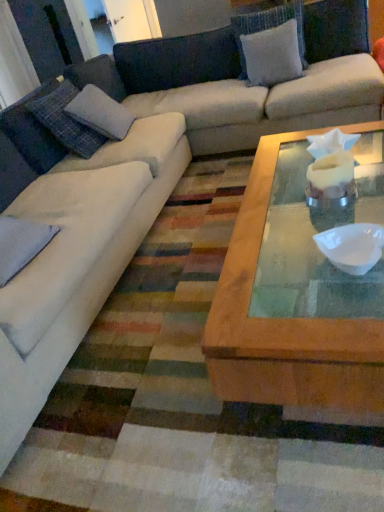
Where is `gray fabric pillow at left, acting as the 3th pillow starting from the back`? This screenshot has height=512, width=384. gray fabric pillow at left, acting as the 3th pillow starting from the back is located at coordinates (21, 244).

In order to face white fabric pillow at upper center, which ranks as the 1th pillow in back-to-front order, should I rotate leftwards or rightwards?

To face it directly, rotate right by 10.611 degrees.

What do you see at coordinates (352, 247) in the screenshot?
I see `white matte bowl at center` at bounding box center [352, 247].

Find the location of a particular element. This screenshot has width=384, height=512. gray fabric pillow at left, acting as the 3th pillow starting from the back is located at coordinates (21, 244).

How many degrees apart are the facing directions of white fabric pillow at upper center, which is counted as the third pillow, starting from the bottom, and gray fabric pillow at left, acting as the third pillow starting from the top?

white fabric pillow at upper center, which is counted as the third pillow, starting from the bottom, and gray fabric pillow at left, acting as the third pillow starting from the top, are facing 80.6 degrees away from each other.

Is white fabric pillow at upper center, which is counted as the third pillow, starting from the bottom, located outside gray fabric pillow at left, which is the 1th pillow from front to back?

Yes, white fabric pillow at upper center, which is counted as the third pillow, starting from the bottom, is not within gray fabric pillow at left, which is the 1th pillow from front to back.

Between white fabric pillow at upper center, marked as the 3th pillow in a left-to-right arrangement, and gray fabric pillow at left, which appears as the 2th pillow when viewed from the right, which one has less height?

gray fabric pillow at left, which appears as the 2th pillow when viewed from the right, is shorter.

Is white fabric pillow at upper center, the first pillow viewed from the top, with gray fabric pillow at left, which appears as the 2th pillow when viewed from the right?

There is a gap between white fabric pillow at upper center, the first pillow viewed from the top, and gray fabric pillow at left, which appears as the 2th pillow when viewed from the right.

Which of these two, gray fabric pillow at left, which appears as the 2th pillow when viewed from the right, or plaid fabric pillow at left, the second pillow in the bottom-to-top sequence, is smaller?

gray fabric pillow at left, which appears as the 2th pillow when viewed from the right, is smaller.

Between gray fabric pillow at left, acting as the 3th pillow starting from the back, and plaid fabric pillow at left, the 1th pillow in the left-to-right sequence, which one has larger width?

gray fabric pillow at left, acting as the 3th pillow starting from the back, is wider.

What's the angular difference between gray fabric pillow at left, positioned as the second pillow in left-to-right order, and plaid fabric pillow at left, acting as the second pillow starting from the top,'s facing directions?

The angular difference between gray fabric pillow at left, positioned as the second pillow in left-to-right order, and plaid fabric pillow at left, acting as the second pillow starting from the top, is 2.38 degrees.

Would you consider gray fabric pillow at left, acting as the third pillow starting from the top, to be distant from plaid fabric pillow at left, acting as the second pillow starting from the top?

Actually, gray fabric pillow at left, acting as the third pillow starting from the top, and plaid fabric pillow at left, acting as the second pillow starting from the top, are a little close together.

Is white fabric pillow at upper center, which is counted as the third pillow, starting from the bottom, aimed at white matte bowl at center?

Yes, white fabric pillow at upper center, which is counted as the third pillow, starting from the bottom, is aimed at white matte bowl at center.

Can you confirm if white fabric pillow at upper center, marked as the third pillow in a front-to-back arrangement, is taller than white matte bowl at center?

Correct, white fabric pillow at upper center, marked as the third pillow in a front-to-back arrangement, is much taller as white matte bowl at center.

Between white fabric pillow at upper center, marked as the third pillow in a front-to-back arrangement, and white matte bowl at center, which one has smaller size?

white matte bowl at center is smaller.

Could you measure the distance between white fabric pillow at upper center, which is counted as the third pillow, starting from the bottom, and white matte bowl at center?

white fabric pillow at upper center, which is counted as the third pillow, starting from the bottom, and white matte bowl at center are 6.48 feet apart from each other.

Can we say gray fabric pillow at left, which is the 1th pillow in bottom-to-top order, lies outside white fabric pillow at upper center, which is counted as the third pillow, starting from the bottom?

Indeed, gray fabric pillow at left, which is the 1th pillow in bottom-to-top order, is completely outside white fabric pillow at upper center, which is counted as the third pillow, starting from the bottom.

Does gray fabric pillow at left, which appears as the 2th pillow when viewed from the right, have a smaller size compared to white fabric pillow at upper center, which ranks as the 1th pillow in back-to-front order?

Yes, gray fabric pillow at left, which appears as the 2th pillow when viewed from the right, is smaller than white fabric pillow at upper center, which ranks as the 1th pillow in back-to-front order.

Which object is positioned more to the right, gray fabric pillow at left, positioned as the second pillow in left-to-right order, or white fabric pillow at upper center, which ranks as the 1th pillow in back-to-front order?

white fabric pillow at upper center, which ranks as the 1th pillow in back-to-front order, is more to the right.

From a real-world perspective, is gray fabric pillow at left, acting as the third pillow starting from the top, physically above white fabric pillow at upper center, marked as the third pillow in a front-to-back arrangement?

No, from a real-world perspective, gray fabric pillow at left, acting as the third pillow starting from the top, is not above white fabric pillow at upper center, marked as the third pillow in a front-to-back arrangement.

Is gray fabric pillow at left, positioned as the second pillow in left-to-right order, smaller than white matte bowl at center?

Actually, gray fabric pillow at left, positioned as the second pillow in left-to-right order, might be larger than white matte bowl at center.

Is gray fabric pillow at left, which is the 1th pillow from front to back, directly adjacent to white matte bowl at center?

gray fabric pillow at left, which is the 1th pillow from front to back, and white matte bowl at center are not in contact.

Can you confirm if gray fabric pillow at left, which is the 1th pillow in bottom-to-top order, is thinner than white matte bowl at center?

Incorrect, the width of gray fabric pillow at left, which is the 1th pillow in bottom-to-top order, is not less than that of white matte bowl at center.

Is gray fabric pillow at left, which is the 1th pillow in bottom-to-top order, aimed at white matte bowl at center?

Yes, gray fabric pillow at left, which is the 1th pillow in bottom-to-top order, is aimed at white matte bowl at center.

From the image's perspective, which object appears higher, white fabric pillow at upper center, the first pillow viewed from the top, or plaid fabric pillow at left, the 1th pillow in the left-to-right sequence?

white fabric pillow at upper center, the first pillow viewed from the top, from the image's perspective.

Consider the image. From a real-world perspective, which object rests below the other?

In real-world perspective, white fabric pillow at upper center, the first pillow viewed from the top, is lower.

Based on their sizes in the image, would you say white fabric pillow at upper center, which ranks as the 1th pillow in back-to-front order, is bigger or smaller than plaid fabric pillow at left, arranged as the third pillow when viewed from the right?

white fabric pillow at upper center, which ranks as the 1th pillow in back-to-front order, is smaller than plaid fabric pillow at left, arranged as the third pillow when viewed from the right.

Considering the positions of point (241, 34) and point (38, 131), is point (241, 34) closer or farther from the camera than point (38, 131)?

Point (241, 34) is farther from the camera than point (38, 131).

Looking at the image, does plaid fabric pillow at left, acting as the second pillow starting from the top, seem bigger or smaller compared to gray fabric pillow at left, acting as the 3th pillow starting from the back?

plaid fabric pillow at left, acting as the second pillow starting from the top, is bigger than gray fabric pillow at left, acting as the 3th pillow starting from the back.

Which of these two, plaid fabric pillow at left, the second pillow in the bottom-to-top sequence, or gray fabric pillow at left, which is the 1th pillow from front to back, is wider?

gray fabric pillow at left, which is the 1th pillow from front to back, is wider.

Is plaid fabric pillow at left, arranged as the 2th pillow when viewed from the front, at the left side of gray fabric pillow at left, positioned as the second pillow in left-to-right order?

Yes, plaid fabric pillow at left, arranged as the 2th pillow when viewed from the front, is to the left of gray fabric pillow at left, positioned as the second pillow in left-to-right order.

There is a gray fabric pillow at left, which is the 1th pillow from front to back. Identify the location of the 1st pillow above it (from a real-world perspective). (272, 54).

This screenshot has width=384, height=512. In order to click on the 2nd pillow positioned below the plaid fabric pillow at left, which ranks as the 2th pillow in back-to-front order (from a real-world perspective) in this screenshot , I will do `click(21, 244)`.

Which object lies further to the anchor point white matte bowl at center, gray fabric pillow at left, which is the 1th pillow from front to back, or plaid fabric pillow at left, the second pillow in the bottom-to-top sequence?

The object further to white matte bowl at center is plaid fabric pillow at left, the second pillow in the bottom-to-top sequence.

Based on their spatial positions, is white fabric pillow at upper center, marked as the third pillow in a front-to-back arrangement, or plaid fabric pillow at left, the 1th pillow in the left-to-right sequence, closer to gray fabric pillow at left, acting as the 3th pillow starting from the back?

plaid fabric pillow at left, the 1th pillow in the left-to-right sequence, lies closer to gray fabric pillow at left, acting as the 3th pillow starting from the back, than the other object.

Based on the photo, estimate the real-world distances between objects in this image. Which object is further from white fabric pillow at upper center, which ranks as the 1th pillow in back-to-front order, gray fabric pillow at left, acting as the third pillow starting from the top, or white matte bowl at center?

white matte bowl at center lies further to white fabric pillow at upper center, which ranks as the 1th pillow in back-to-front order, than the other object.

Based on the photo, which object lies nearer to the anchor point plaid fabric pillow at left, arranged as the 2th pillow when viewed from the front, gray fabric pillow at left, which is the 1th pillow in bottom-to-top order, or white fabric pillow at upper center, the first pillow viewed from the top?

gray fabric pillow at left, which is the 1th pillow in bottom-to-top order, is closer to plaid fabric pillow at left, arranged as the 2th pillow when viewed from the front.

Which object lies nearer to the anchor point gray fabric pillow at left, acting as the 3th pillow starting from the back, white matte bowl at center or white fabric pillow at upper center, the first pillow viewed from the top?

white matte bowl at center is closer to gray fabric pillow at left, acting as the 3th pillow starting from the back.

Which object lies nearer to the anchor point white matte bowl at center, plaid fabric pillow at left, arranged as the third pillow when viewed from the right, or white fabric pillow at upper center, the first pillow viewed from the top?

plaid fabric pillow at left, arranged as the third pillow when viewed from the right, lies closer to white matte bowl at center than the other object.

Based on their spatial positions, is white matte bowl at center or gray fabric pillow at left, which is the 1th pillow in bottom-to-top order, closer to plaid fabric pillow at left, arranged as the 2th pillow when viewed from the front?

gray fabric pillow at left, which is the 1th pillow in bottom-to-top order.

Based on their spatial positions, is gray fabric pillow at left, which appears as the 2th pillow when viewed from the right, or white matte bowl at center further from plaid fabric pillow at left, arranged as the 2th pillow when viewed from the front?

white matte bowl at center.

Find the location of a particular element. The image size is (384, 512). pillow between plaid fabric pillow at left, the second pillow in the bottom-to-top sequence, and white matte bowl at center is located at coordinates (21, 244).

Locate an element on the screen. The height and width of the screenshot is (512, 384). pillow between plaid fabric pillow at left, the second pillow in the bottom-to-top sequence, and white fabric pillow at upper center, the first pillow viewed from the top, in the horizontal direction is located at coordinates (21, 244).